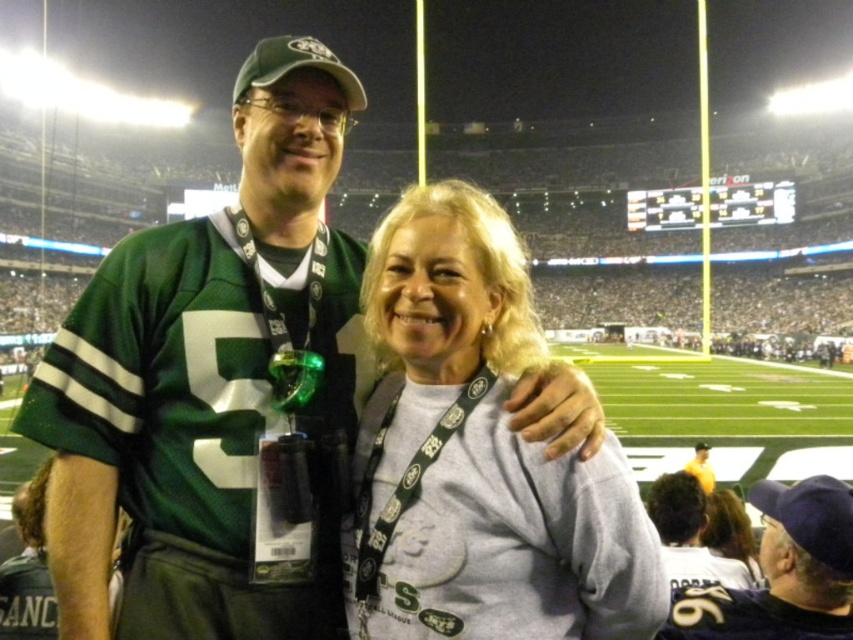
Question: Which point appears closest to the camera in this image?

Choices:
 (A) (734, 579)
 (B) (711, 486)
 (C) (521, 259)
 (D) (689, 604)

Answer: (D)

Question: Is the position of green jersey at center more distant than that of matte green jersey at center?

Choices:
 (A) no
 (B) yes

Answer: (A)

Question: Is matte green jersey at center to the left of white jersey at center from the viewer's perspective?

Choices:
 (A) yes
 (B) no

Answer: (B)

Question: Which object is the farthest from the light brown hair at lower right?

Choices:
 (A) green jersey at center
 (B) white jersey at center

Answer: (A)

Question: Which point is farther from the camera taking this photo?

Choices:
 (A) (674, 536)
 (B) (709, 483)
 (C) (676, 604)
 (D) (701, 538)

Answer: (B)

Question: Is the position of gray cotton sweatshirt at center less distant than that of light brown hair at lower right?

Choices:
 (A) no
 (B) yes

Answer: (B)